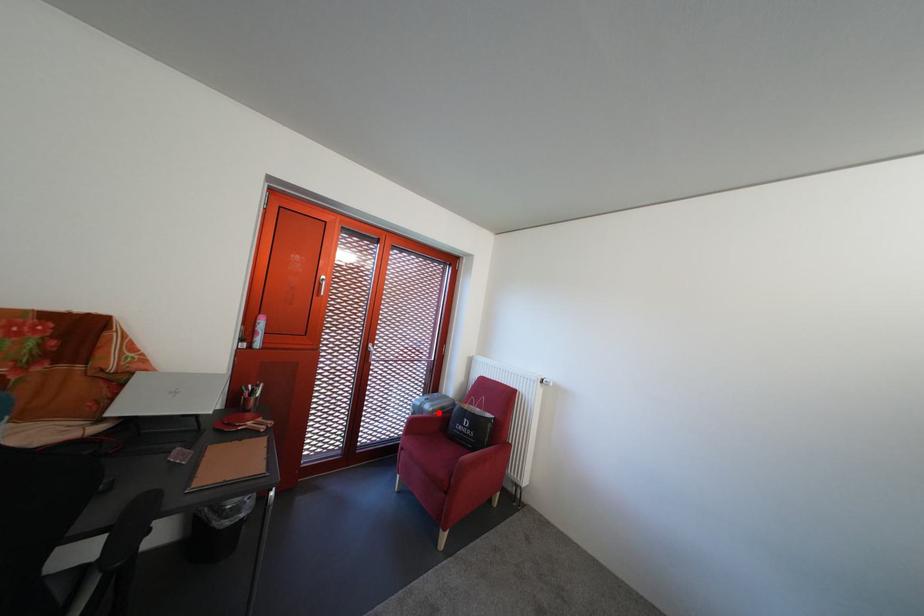
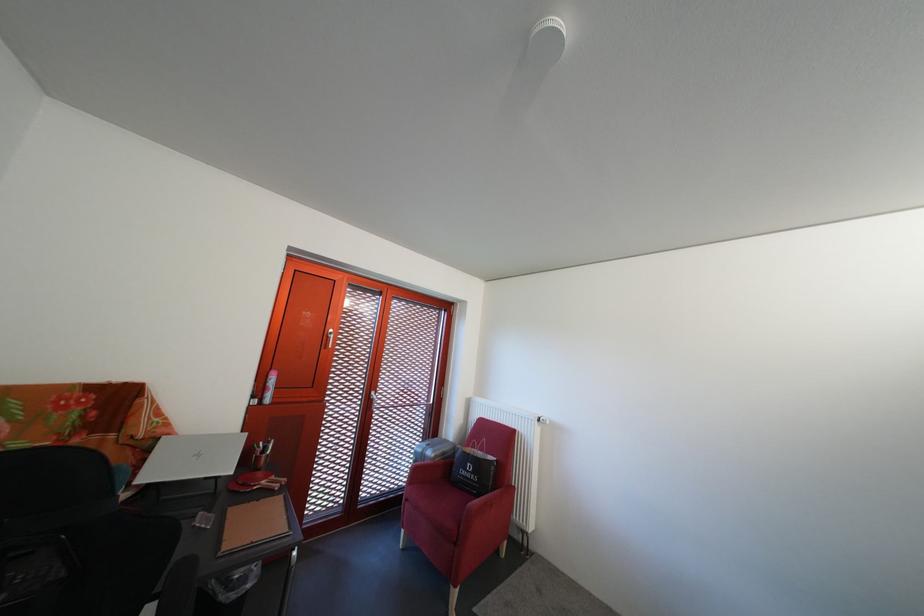
Question: A red point is marked in image1. In image2, is the corresponding 3D point closer to the camera or farther? Reply with the corresponding letter.

Choices:
 (A) The corresponding 3D point is closer.
 (B) The corresponding 3D point is farther.

Answer: (B)